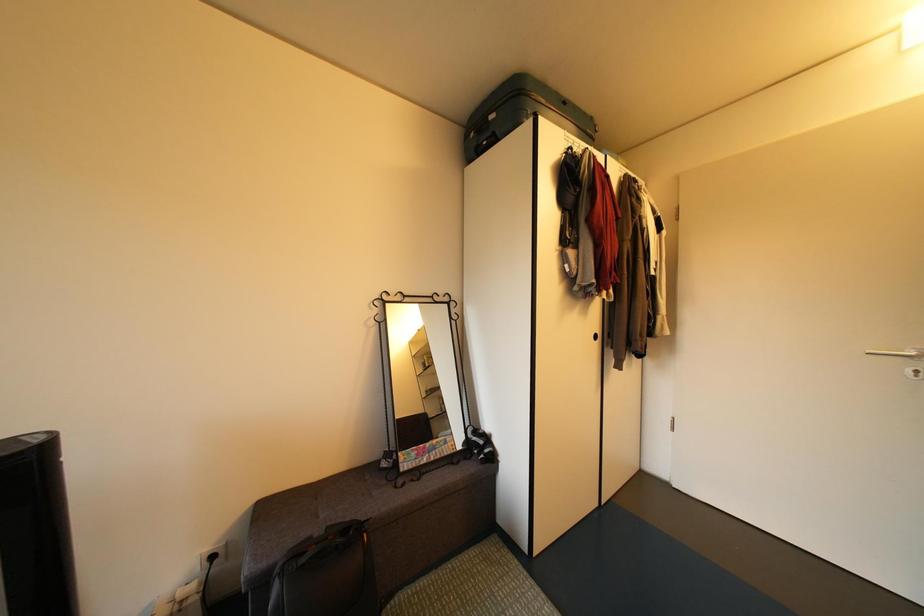
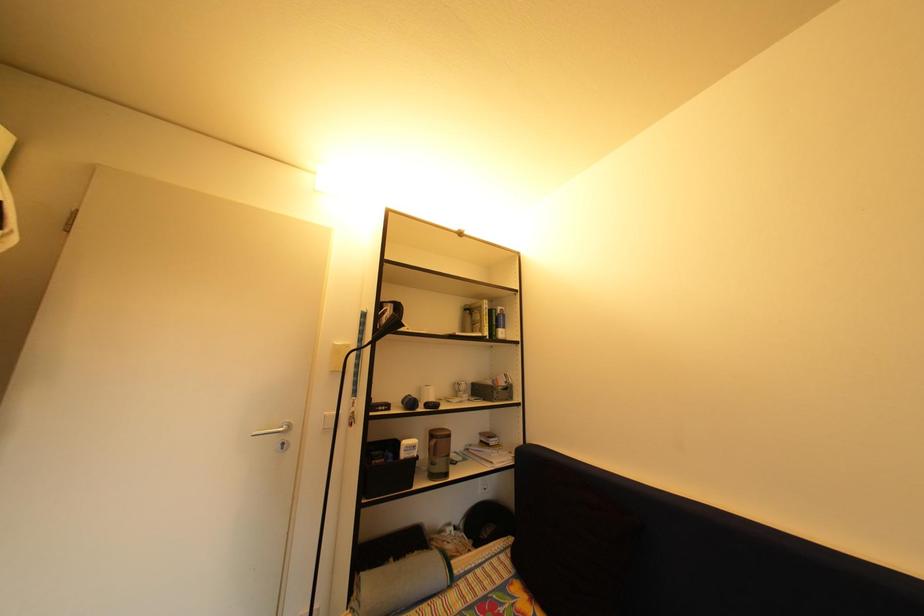
Question: The camera is either moving clockwise (left) or counter-clockwise (right) around the object. The first image is from the beginning of the video and the second image is from the end. Is the camera moving left or right when shooting the video?

Choices:
 (A) Left
 (B) Right

Answer: (A)